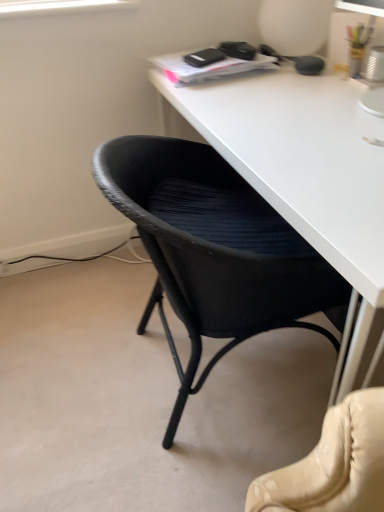
I want to click on black woven chair at center, so click(x=214, y=250).

In order to face black woven chair at center, should I rotate leftwards or rightwards?

It's best to rotate right around 3.145 degrees.

Describe the element at coordinates (214, 250) in the screenshot. I see `black woven chair at center` at that location.

Where is `black woven chair at center`? black woven chair at center is located at coordinates (214, 250).